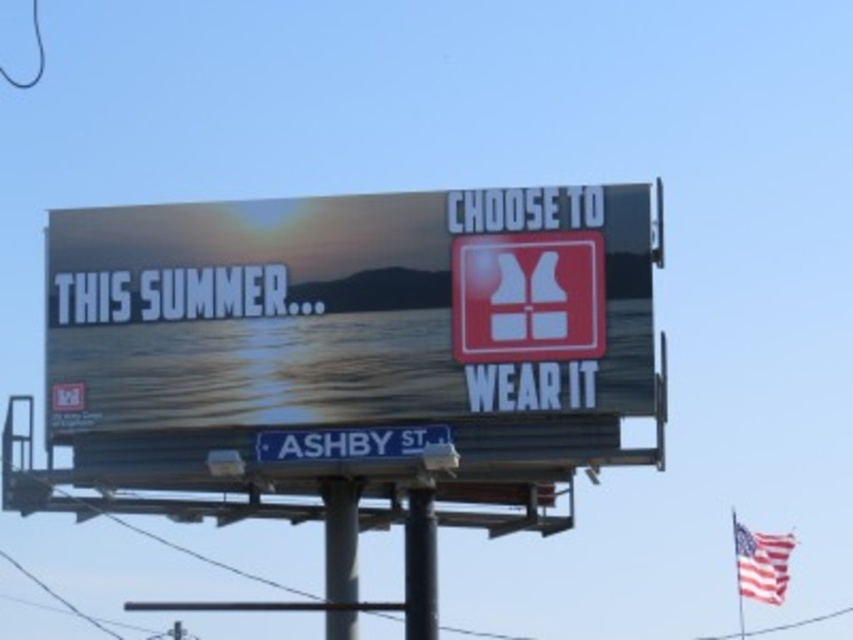
From the picture: Which is more to the right, white plastic street sign at lower center or metallic gray pole at center?

From the viewer's perspective, white plastic street sign at lower center appears more on the right side.

Is point (380, 444) positioned in front of point (328, 552)?

Yes, point (380, 444) is closer to viewer.

The height and width of the screenshot is (640, 853). In order to click on white plastic street sign at lower center in this screenshot , I will do `click(349, 442)`.

Who is positioned more to the right, matte white sign at center or metallic gray pole at center?

From the viewer's perspective, metallic gray pole at center appears more on the right side.

Can you confirm if matte white sign at center is taller than metallic gray pole at center?

Indeed, matte white sign at center has a greater height compared to metallic gray pole at center.

Does point (293, 240) lie in front of point (323, 561)?

Yes, it is.

Where is `matte white sign at center`? This screenshot has width=853, height=640. matte white sign at center is located at coordinates (352, 317).

Between metallic gray pole at center and black metal pole at center, which one appears on the right side from the viewer's perspective?

Positioned to the right is black metal pole at center.

Is metallic gray pole at center wider than black metal pole at center?

Yes, metallic gray pole at center is wider than black metal pole at center.

The image size is (853, 640). Describe the element at coordinates (340, 540) in the screenshot. I see `metallic gray pole at center` at that location.

Where is `metallic gray pole at center`? metallic gray pole at center is located at coordinates (340, 540).